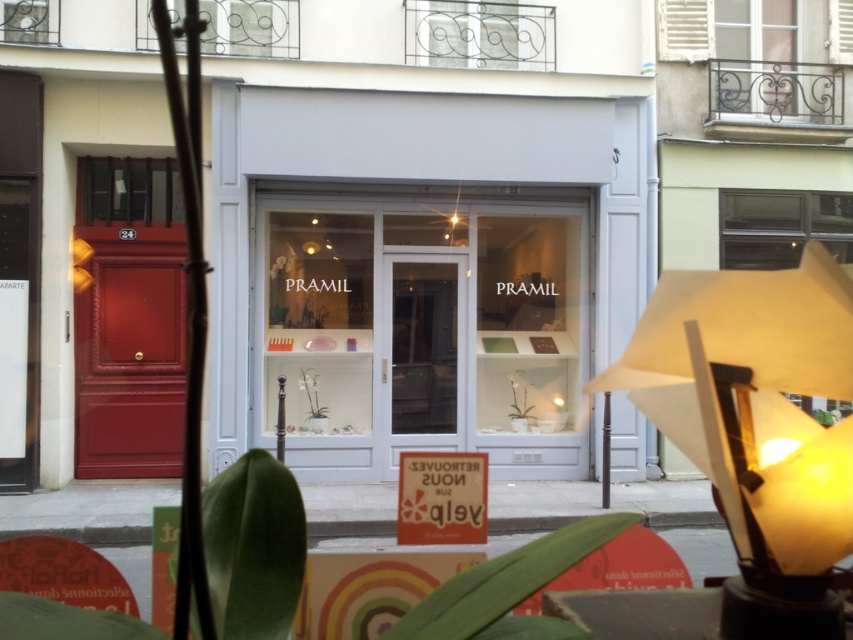
Looking at this image, you are a customer standing outside the store and want to enter. The store has a smooth glossy door at left and a matte orange sign at center. Which object is closer to you as you face the store?

The smooth glossy door at left is closer to you because the matte orange sign at center is behind it, meaning the door is in front.

You are standing in front of the store and want to enter. The smooth glossy door at left has a doorknob. To reach the doorknob, should you look up towards the metallic wirework at upper center or down towards the ground?

The smooth glossy door at left is positioned under the metallic wirework at upper center, so to reach the doorknob, you should look down towards the ground rather than up towards the metallic wirework at upper center.